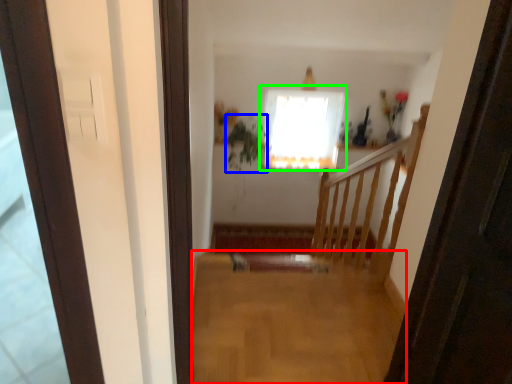
Question: Which object is positioned farthest from plain (highlighted by a red box)? Select from plant (highlighted by a blue box) and window (highlighted by a green box).

Choices:
 (A) plant
 (B) window

Answer: (A)